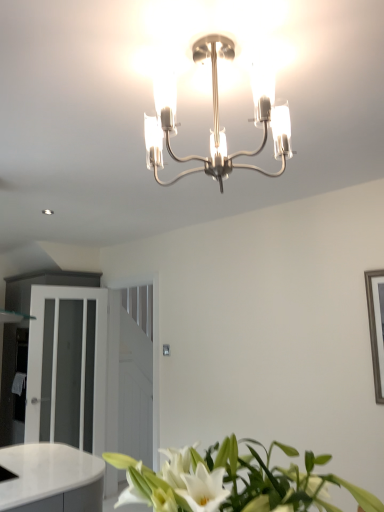
Question: From the image's perspective, is white glossy dresser at left located above or below white frosted glass door at left?

Choices:
 (A) above
 (B) below

Answer: (B)

Question: Considering the positions of white glossy dresser at left and white frosted glass door at left in the image, is white glossy dresser at left taller or shorter than white frosted glass door at left?

Choices:
 (A) short
 (B) tall

Answer: (B)

Question: Which object is the farthest from the white frosted glass door at left?

Choices:
 (A) polished chrome chandelier at center
 (B) white glossy dresser at left
 (C) white glossy leaves at lower center

Answer: (A)

Question: Considering the real-world distances, which object is closest to the white frosted glass door at left?

Choices:
 (A) polished chrome chandelier at center
 (B) white glossy dresser at left
 (C) white glossy leaves at lower center

Answer: (B)